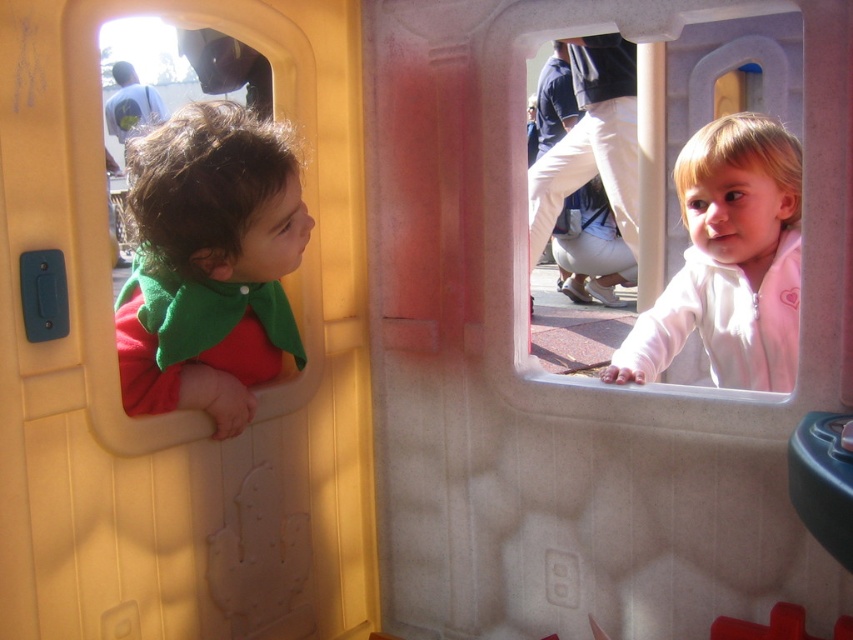
Looking at this image, is white fleece jacket at upper right to the left of white cotton pants at center from the viewer's perspective?

Correct, you'll find white fleece jacket at upper right to the left of white cotton pants at center.

Can you confirm if white fleece jacket at upper right is shorter than white cotton pants at center?

Correct, white fleece jacket at upper right is not as tall as white cotton pants at center.

Is point (764, 355) closer to viewer compared to point (543, 164)?

Yes, point (764, 355) is in front of point (543, 164).

Locate an element on the screen. Image resolution: width=853 pixels, height=640 pixels. white fleece jacket at upper right is located at coordinates (729, 260).

Is point (193, 241) closer to viewer compared to point (566, 132)?

Yes, it is in front of point (566, 132).

Does matte green cape at left have a larger size compared to white cotton pants at center?

No, matte green cape at left is not bigger than white cotton pants at center.

Identify the location of matte green cape at left. (209, 264).

Which is more to the right, matte green cape at left or white fleece jacket at upper right?

white fleece jacket at upper right

Which of these two, matte green cape at left or white fleece jacket at upper right, stands taller?

matte green cape at left is taller.

Between point (177, 234) and point (692, 298), which one is positioned behind?

The point (692, 298) is behind.

You are a GUI agent. You are given a task and a screenshot of the screen. Output one action in this format:
    pyautogui.click(x=<x>, y=<y>)
    Task: Click on the matte green cape at left
    This screenshot has width=853, height=640.
    Given the screenshot: What is the action you would take?
    pyautogui.click(x=209, y=264)